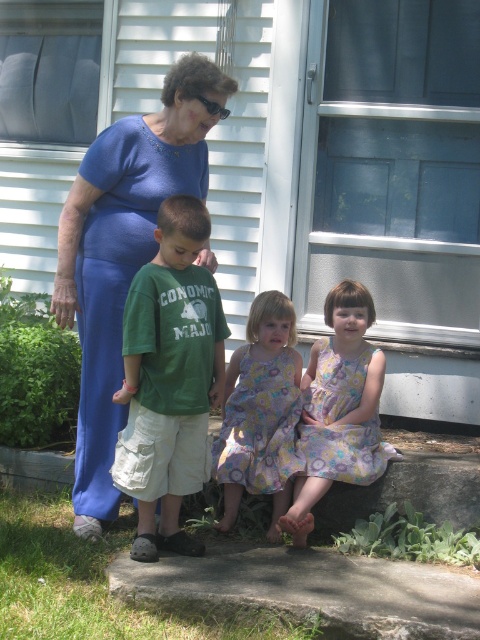
Is blue satin dress at upper left bigger than green cotton shirt at center?

Yes.

Is blue satin dress at upper left behind green cotton shirt at center?

Yes.

Find the location of a particular element. The width and height of the screenshot is (480, 640). blue satin dress at upper left is located at coordinates (123, 253).

Does green cotton shirt at center have a smaller size compared to floral dress at center?

No.

Which is more to the left, green cotton shirt at center or floral dress at center?

green cotton shirt at center

The height and width of the screenshot is (640, 480). I want to click on green cotton shirt at center, so click(169, 378).

Find the location of a particular element. The width and height of the screenshot is (480, 640). green cotton shirt at center is located at coordinates (169, 378).

Which is more to the left, blue satin dress at upper left or floral dress at center?

blue satin dress at upper left is more to the left.

Does blue satin dress at upper left have a greater width compared to floral dress at center?

Yes.

Which is in front, point (144, 170) or point (288, 381)?

Point (144, 170) is more forward.

Find the location of a particular element. The image size is (480, 640). blue satin dress at upper left is located at coordinates (123, 253).